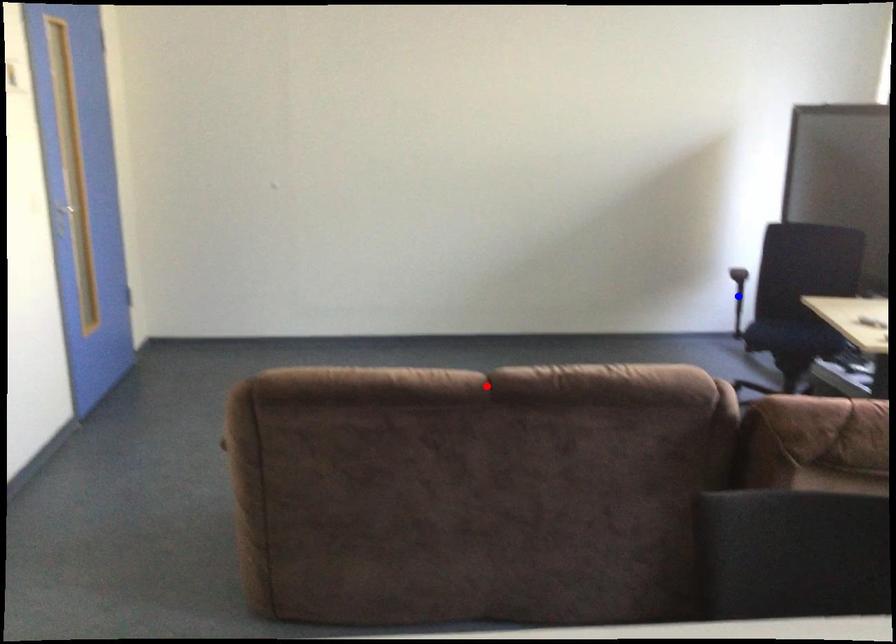
Question: Two points are marked on the image. Which point is closer to the camera?

Choices:
 (A) Blue point is closer.
 (B) Red point is closer.

Answer: (B)